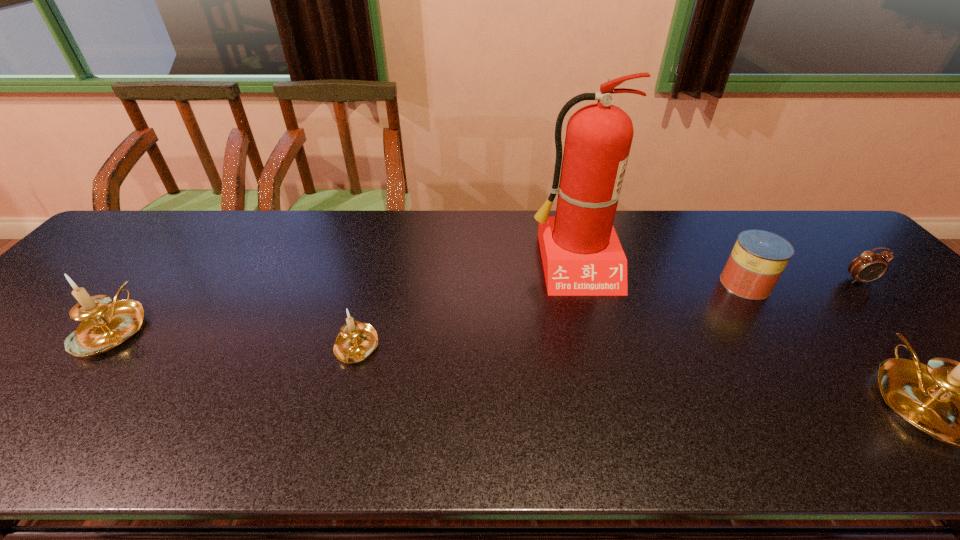
In the image, there is a desktop. Where is `free region at the right edge`? free region at the right edge is located at coordinates (843, 262).

Image resolution: width=960 pixels, height=540 pixels. I want to click on free space at the far left corner, so click(x=145, y=242).

At what (x,y) coordinates should I click in order to perform the action: click on vacant space at the far right corner. Please return your answer as a coordinate pair (x, y). Looking at the image, I should click on (837, 245).

In order to click on free space that is in between the shortest candle holder and the tallest object in this screenshot , I will do `click(465, 306)`.

Identify the location of free space that is in between the second tallest candle holder and the alarm clock. This screenshot has height=540, width=960. (487, 304).

The height and width of the screenshot is (540, 960). I want to click on free area in between the second candle holder from right to left and the leftmost candle holder, so click(x=234, y=338).

At what (x,y) coordinates should I click in order to perform the action: click on free point between the fourth object from right to left and the fourth object from left to right. Please return your answer as a coordinate pair (x, y). This screenshot has width=960, height=540. Looking at the image, I should click on (660, 274).

Where is `free space between the leftmost object and the alarm clock`? free space between the leftmost object and the alarm clock is located at coordinates (487, 304).

Find the location of a particular element. free space between the shortest candle holder and the tallest object is located at coordinates (465, 306).

Find the location of a particular element. The height and width of the screenshot is (540, 960). vacant area that lies between the shortest candle holder and the third object from left to right is located at coordinates (465, 306).